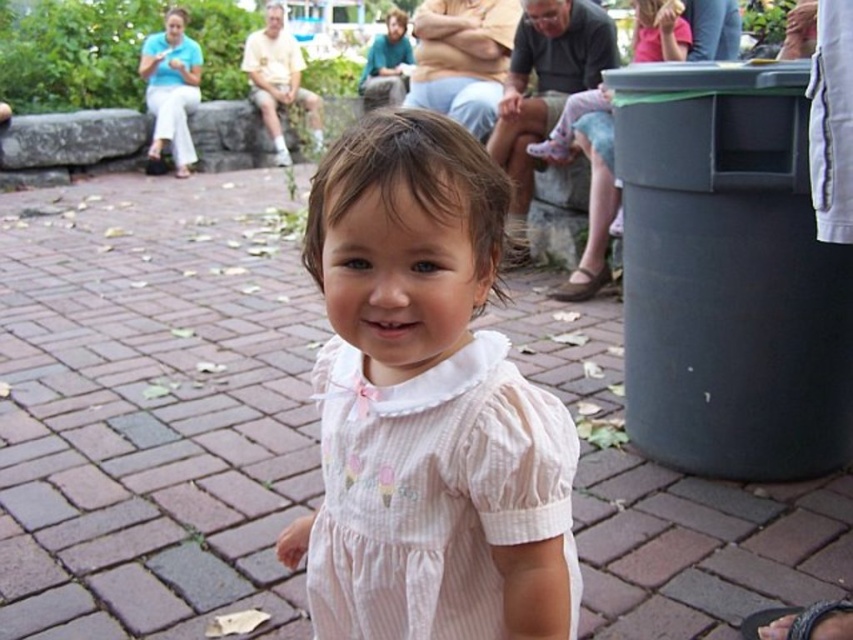
Where is the pink fabric dress at lower right located in the image?

The pink fabric dress at lower right is located at point [589,182] in the image.

Where is the pink striped dress at center located in the image?

The pink striped dress at center is located at point (433,493).